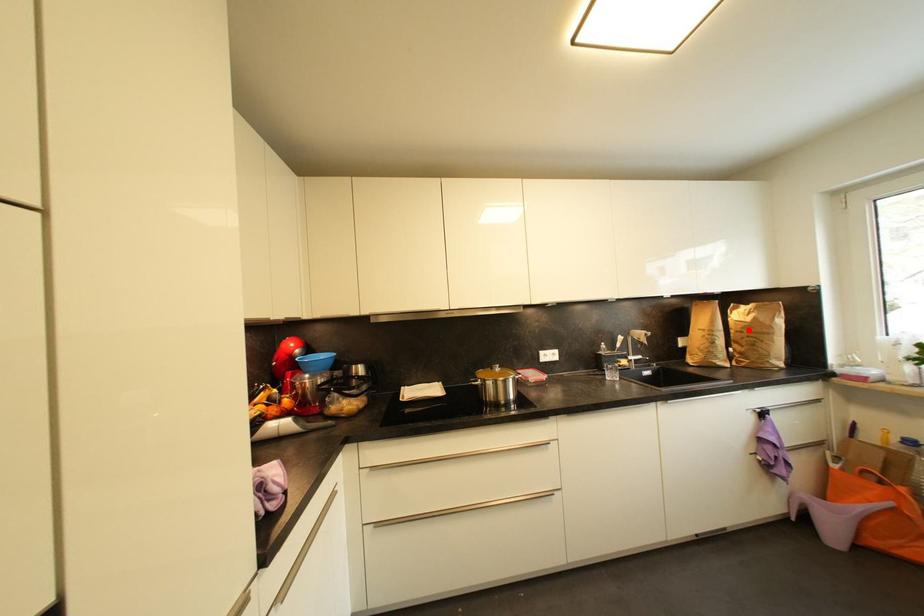
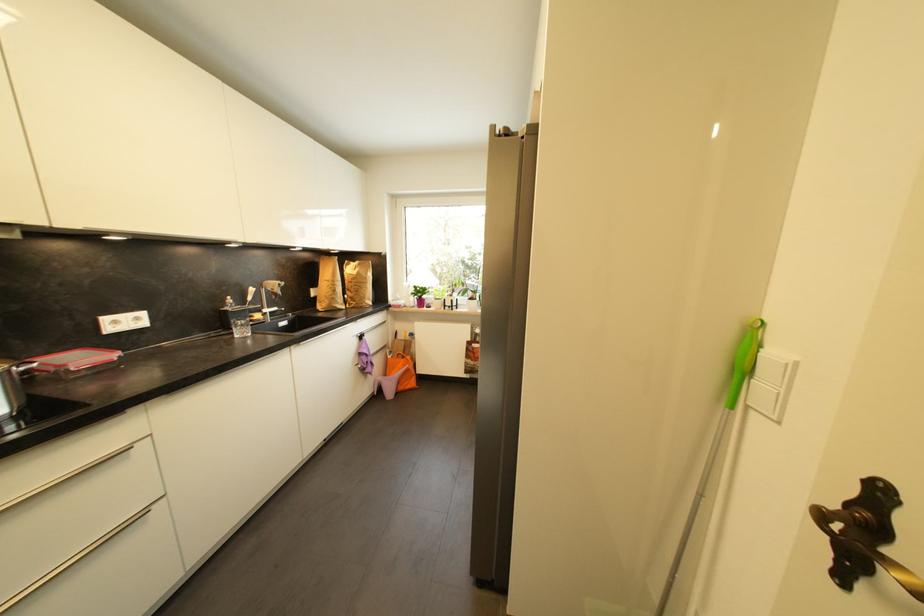
In the second image, find the point that corresponds to the highlighted location in the first image.

(358, 281)